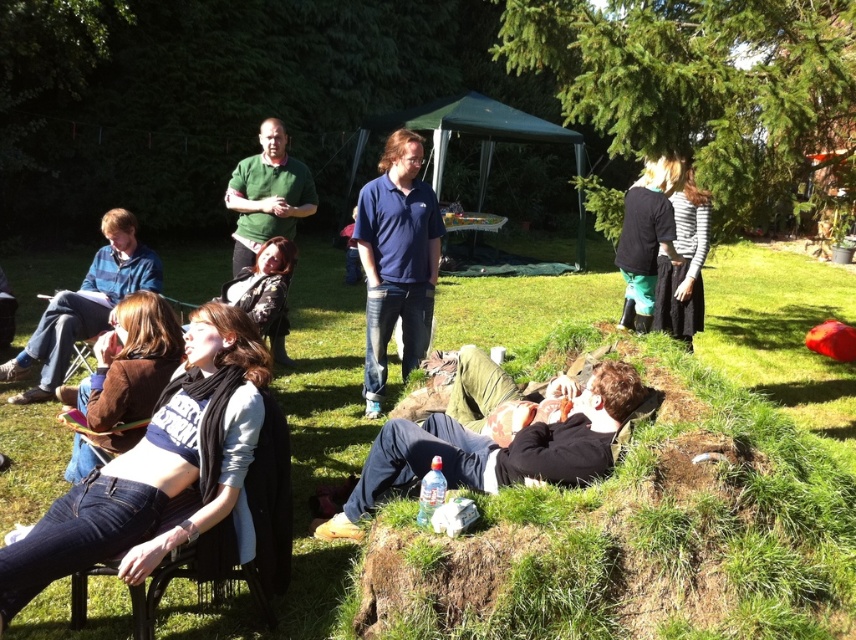
You are planning to take a photo of the jeans at lower left and the blue cotton shirt at center. Which one should you focus on first if you want to capture both in the same frame without moving the camera?

You should focus on the jeans at lower left first because it has a lesser height compared to the blue cotton shirt at center, so adjusting focus from closer to farther would ensure both are in focus.

You are organizing a picnic and need to fit both the blue cotton shirt at center and the striped cotton shirt at center into a rectangular storage box. Based on their widths, which shirt should you place first to ensure both fit properly?

The blue cotton shirt at center is wider than the striped cotton shirt at center, so you should place the blue cotton shirt at center first to ensure both fit properly.